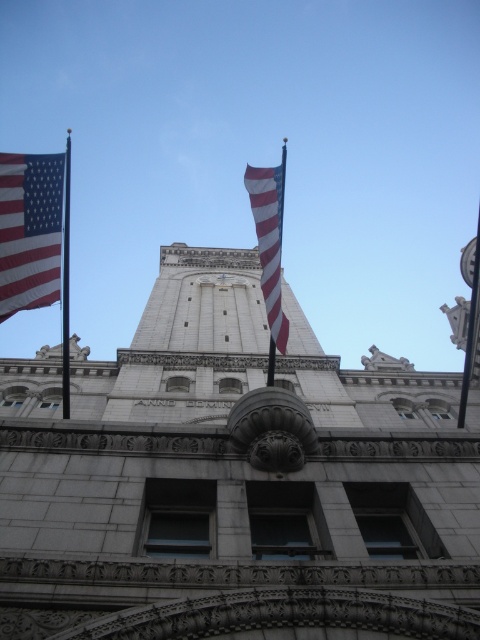
Question: Among these points, which one is nearest to the camera?

Choices:
 (A) (x=84, y=465)
 (B) (x=41, y=157)

Answer: (A)

Question: Which point is farther from the camera taking this photo?

Choices:
 (A) (283, 211)
 (B) (67, 161)

Answer: (B)

Question: Does matte fabric flag at left appear on the left side of matte fabric flag at center?

Choices:
 (A) yes
 (B) no

Answer: (A)

Question: Estimate the real-world distances between objects in this image. Which object is farther from the matte fabric flag at center?

Choices:
 (A) white stone tower at center
 (B) polished metal flag pole at left

Answer: (B)

Question: Is matte fabric flag at left closer to the viewer compared to polished metal flag pole at left?

Choices:
 (A) no
 (B) yes

Answer: (B)

Question: Does white stone tower at center appear over matte fabric flag at center?

Choices:
 (A) yes
 (B) no

Answer: (B)